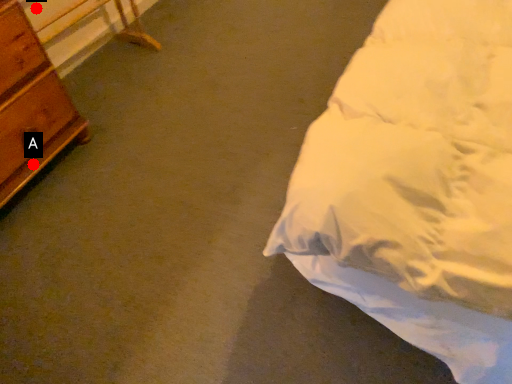
Question: Two points are circled on the image, labeled by A and B beside each circle. Which of the following is the closest to the observer?

Choices:
 (A) A is closer
 (B) B is closer

Answer: (A)